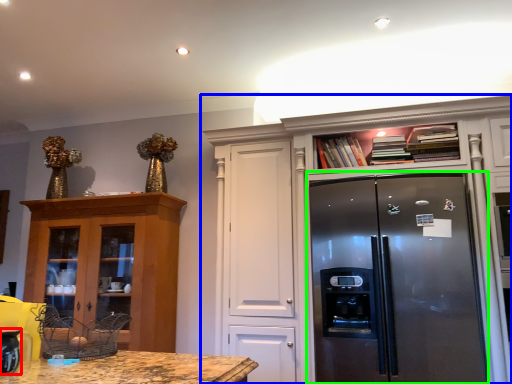
Question: Which object is the farthest from appliance (highlighted by a red box)? Choose among these: cabinetry (highlighted by a blue box) or refrigerator (highlighted by a green box).

Choices:
 (A) cabinetry
 (B) refrigerator

Answer: (A)